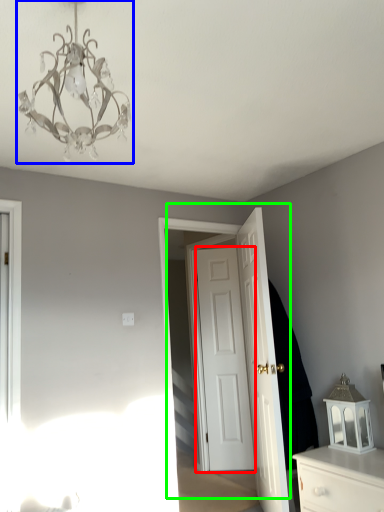
Question: Based on their relative distances, which object is nearer to door (highlighted by a red box)? Choose from lamp (highlighted by a blue box) and door (highlighted by a green box).

Choices:
 (A) lamp
 (B) door

Answer: (B)